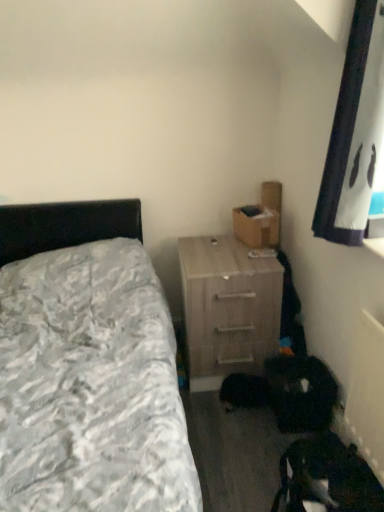
You are a GUI agent. You are given a task and a screenshot of the screen. Output one action in this format:
    pyautogui.click(x=<x>, y=<y>)
    Task: Click on the unoccupied area in front of brown cardboard box at upper right
    The height and width of the screenshot is (512, 384).
    Given the screenshot: What is the action you would take?
    pyautogui.click(x=238, y=247)